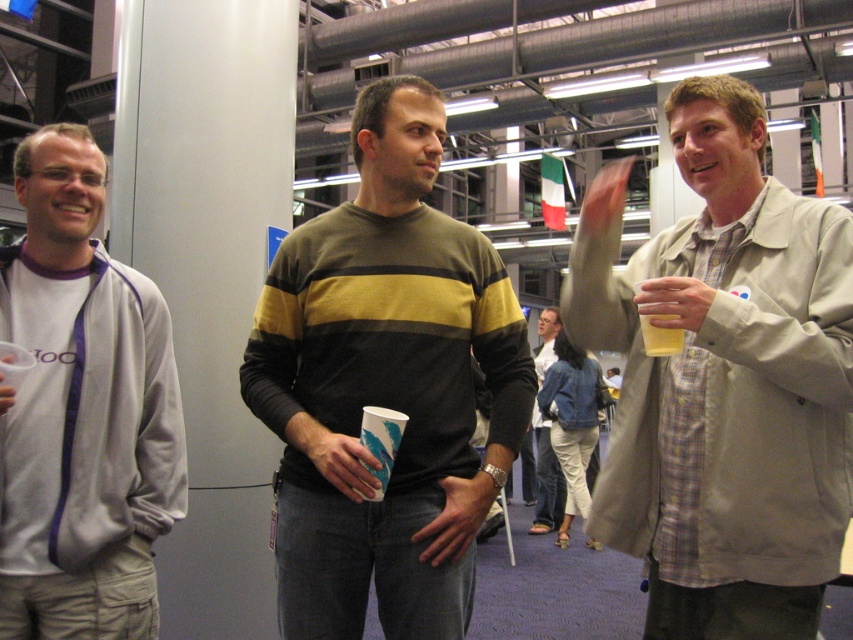
Question: Which point is closer to the camera taking this photo?

Choices:
 (A) (318, 493)
 (B) (9, 490)
 (C) (558, 496)

Answer: (B)

Question: Can you confirm if light beige jacket at right is positioned below striped sweater at center?

Choices:
 (A) yes
 (B) no

Answer: (A)

Question: Can you confirm if light beige jacket at right is smaller than gray fleece jacket at left?

Choices:
 (A) yes
 (B) no

Answer: (B)

Question: Which of these objects is positioned closest to the light beige jacket at right?

Choices:
 (A) denim jacket at center
 (B) yellow matte cup at right
 (C) striped sweater at center

Answer: (B)

Question: Is light beige jacket at right bigger than striped sweater at center?

Choices:
 (A) yes
 (B) no

Answer: (B)

Question: Which object is farther from the camera taking this photo?

Choices:
 (A) yellow matte cup at right
 (B) gray fleece jacket at left
 (C) light beige jacket at right
 (D) striped sweater at center

Answer: (D)